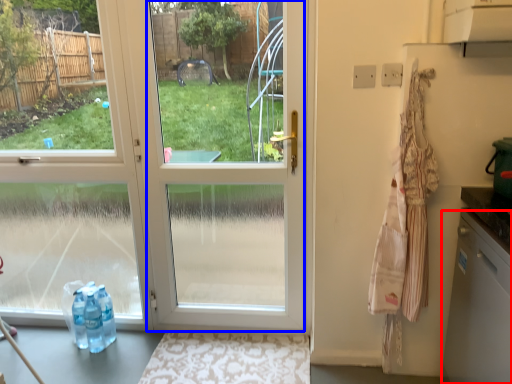
Question: Which object appears closest to the camera in this image, dish washer (highlighted by a red box) or glass door (highlighted by a blue box)?

Choices:
 (A) dish washer
 (B) glass door

Answer: (A)